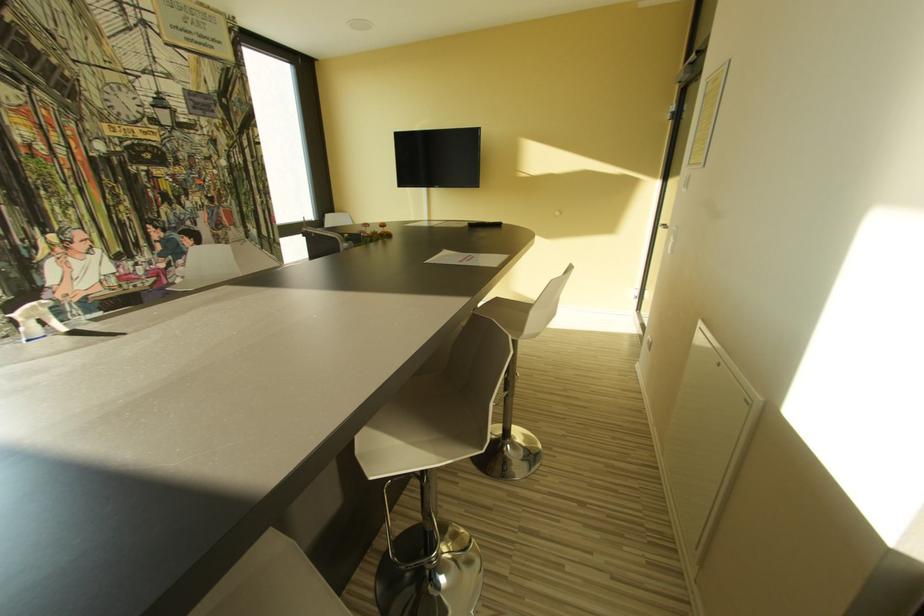
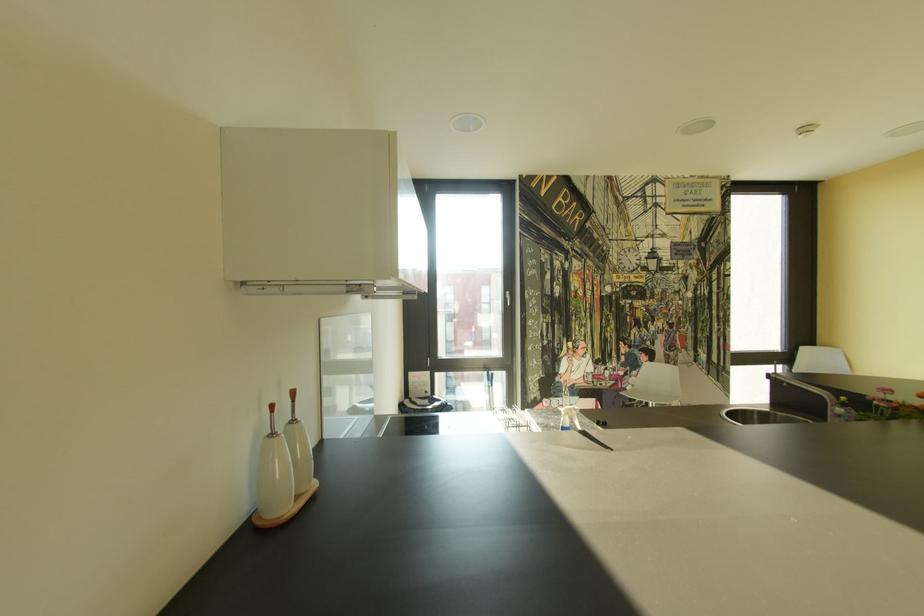
Question: The camera is either moving clockwise (left) or counter-clockwise (right) around the object. The first image is from the beginning of the video and the second image is from the end. Is the camera moving left or right when shooting the video?

Choices:
 (A) Left
 (B) Right

Answer: (B)